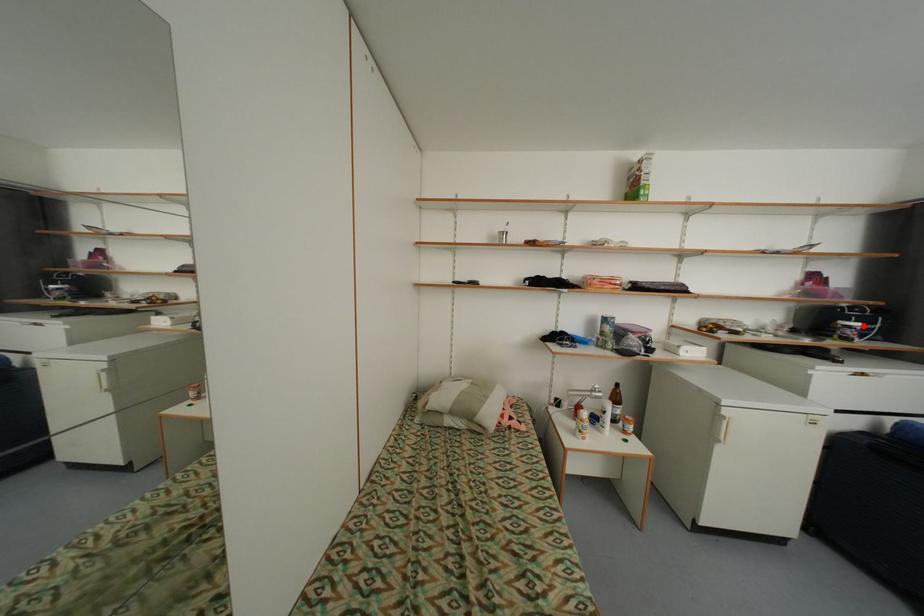
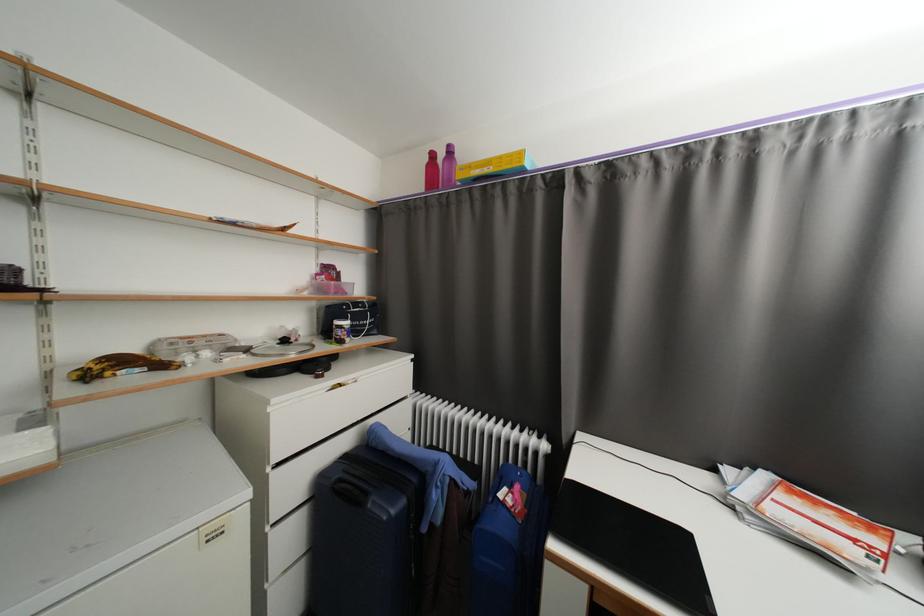
Question: I am providing you with two images of the same scene from different viewpoints. Image1 has a red point marked. In image2, the corresponding 3D location appears at what relative position? Reply with the corresponding letter.

Choices:
 (A) Closer
 (B) Farther

Answer: (B)